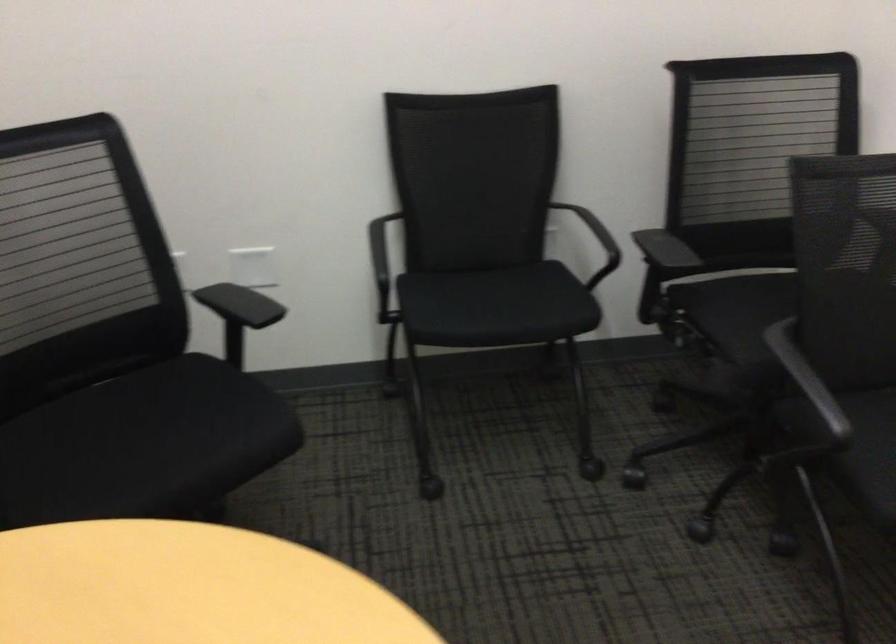
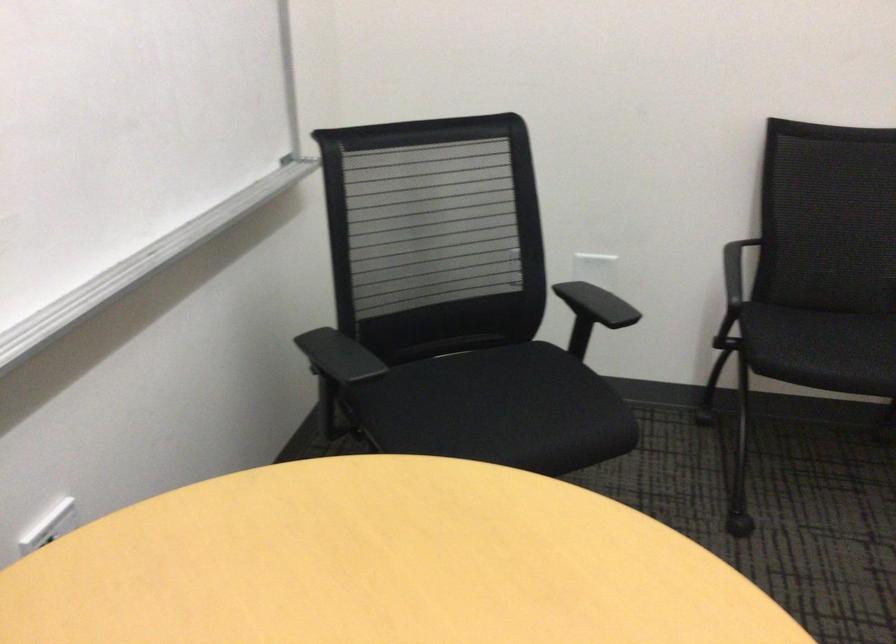
In the second image, find the point that corresponds to point (470, 308) in the first image.

(821, 348)